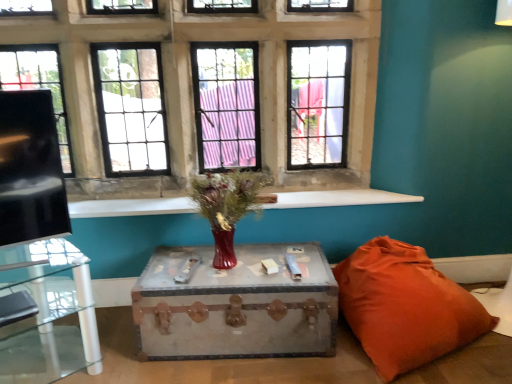
The image size is (512, 384). In order to click on free area in between orange fabric pillow at lower right and rustic metal trunk at center, the 1th table in the right-to-left sequence in this screenshot , I will do `click(271, 372)`.